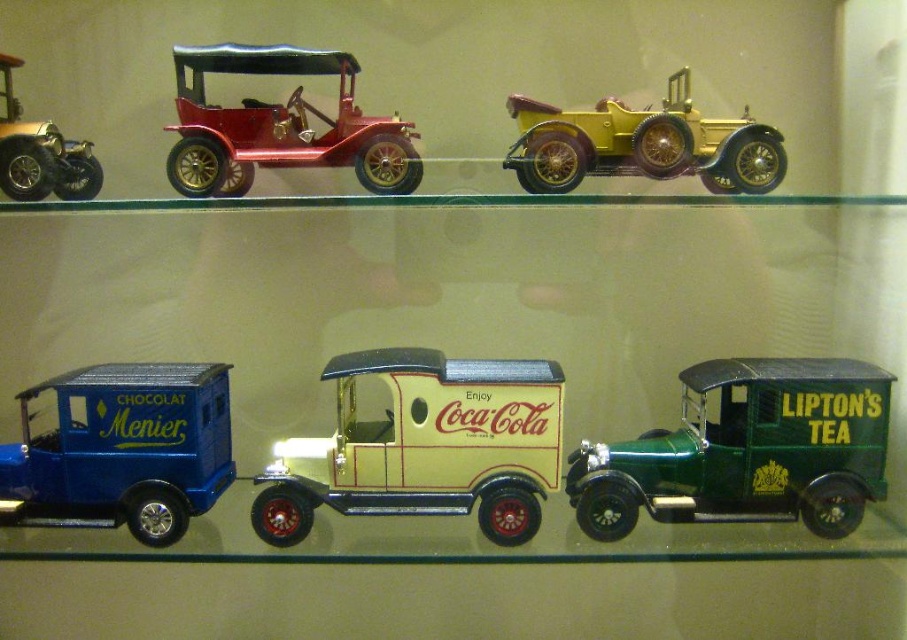
From the picture: Who is more distant from viewer, (683, 97) or (81, 161)?

The point (683, 97) is behind.

Does gold polished wood car at upper center have a lesser width compared to shiny gold car at upper left?

Incorrect, gold polished wood car at upper center's width is not less than shiny gold car at upper left's.

Where is `gold polished wood car at upper center`? This screenshot has height=640, width=907. gold polished wood car at upper center is located at coordinates (642, 145).

Which is behind, point (10, 481) or point (649, 106)?

Point (649, 106)

Locate an element on the screen. This screenshot has width=907, height=640. metallic blue van at lower left is located at coordinates (124, 449).

This screenshot has height=640, width=907. What are the coordinates of `metallic blue van at lower left` in the screenshot? It's located at (124, 449).

Find the location of a particular element. metallic blue van at lower left is located at coordinates (124, 449).

Who is positioned more to the right, shiny red car at center or gold polished wood car at upper center?

gold polished wood car at upper center

Is shiny red car at center closer to camera compared to gold polished wood car at upper center?

Yes, shiny red car at center is closer to the viewer.

At what (x,y) coordinates should I click in order to perform the action: click on shiny red car at center. Please return your answer as a coordinate pair (x, y). The width and height of the screenshot is (907, 640). Looking at the image, I should click on (279, 125).